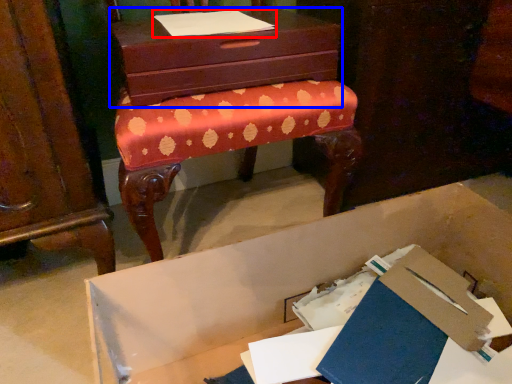
Question: Which object is further to the camera taking this photo, notebook (highlighted by a red box) or chest of drawers (highlighted by a blue box)?

Choices:
 (A) notebook
 (B) chest of drawers

Answer: (A)